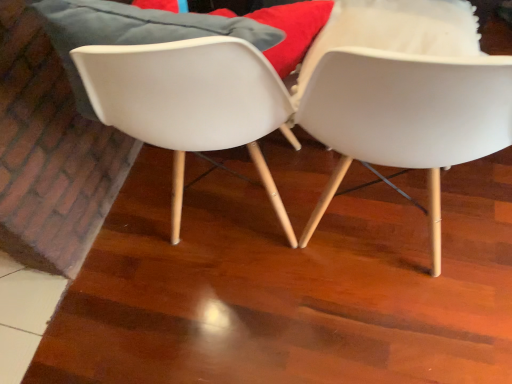
The image size is (512, 384). Find the location of `free location in front of white plastic chair at center, the first chair viewed from the left`. free location in front of white plastic chair at center, the first chair viewed from the left is located at coordinates (267, 328).